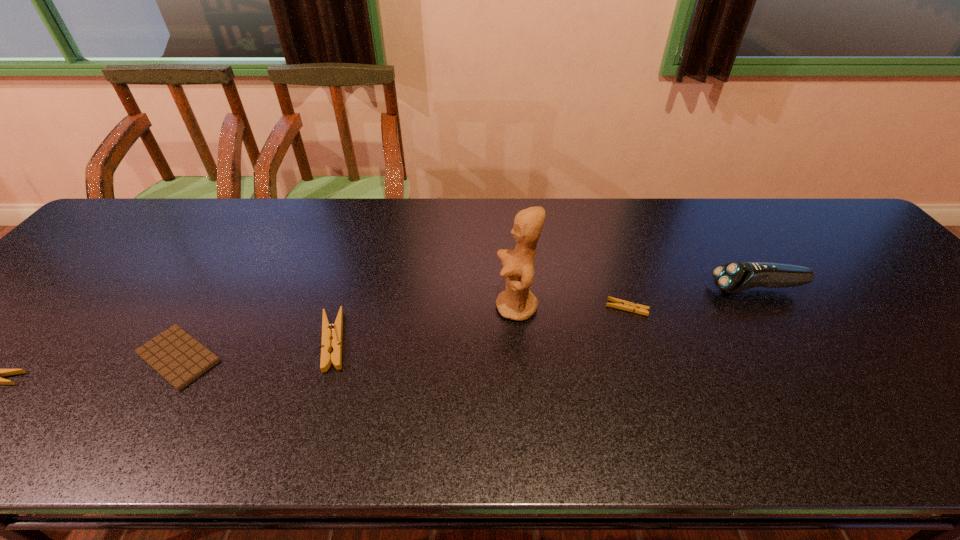
At what (x,y) coordinates should I click in order to perform the action: click on free point that keeps the clothespins evenly spaced on the right. Please return your answer as a coordinate pair (x, y). This screenshot has width=960, height=540. Looking at the image, I should click on [x=883, y=279].